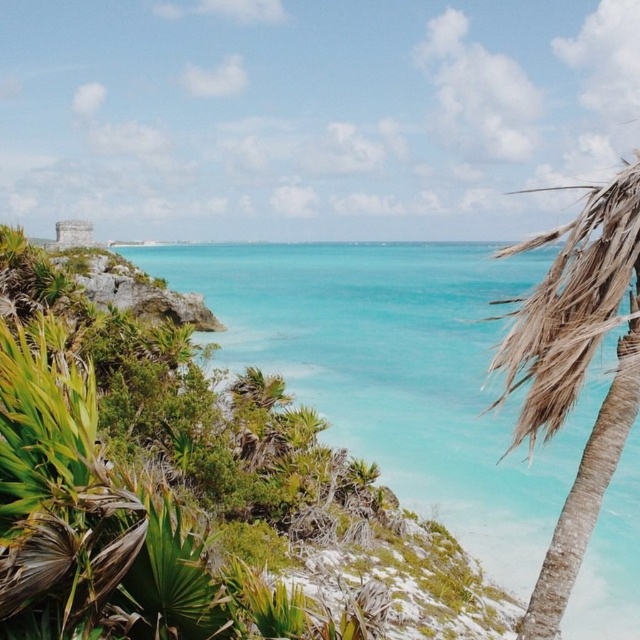
Is point (496, 289) in front of point (573, 330)?

No.

Is turquoise water at center positioned in front of brown textured palm tree at right?

No.

Locate an element on the screen. This screenshot has height=640, width=640. turquoise water at center is located at coordinates (401, 371).